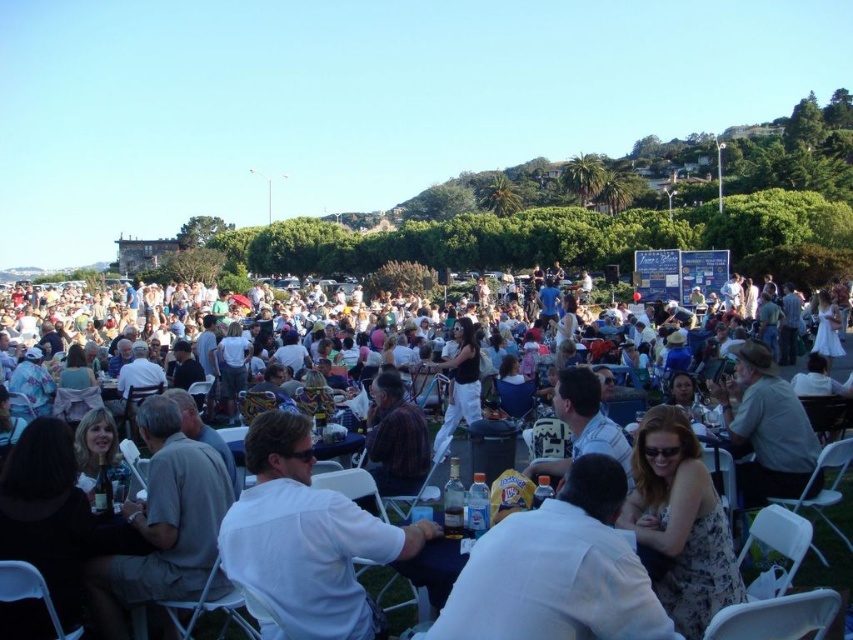
Does point (161, 344) lie in front of point (267, 548)?

No.

What do you see at coordinates (207, 376) in the screenshot? I see `white plastic chairs at center` at bounding box center [207, 376].

Where is `white plastic chairs at center`? Image resolution: width=853 pixels, height=640 pixels. white plastic chairs at center is located at coordinates (207, 376).